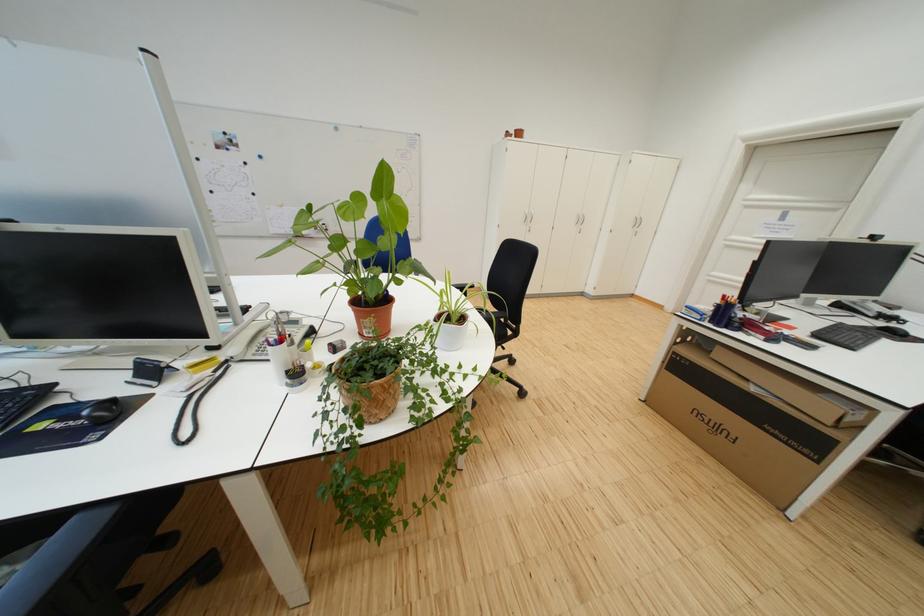
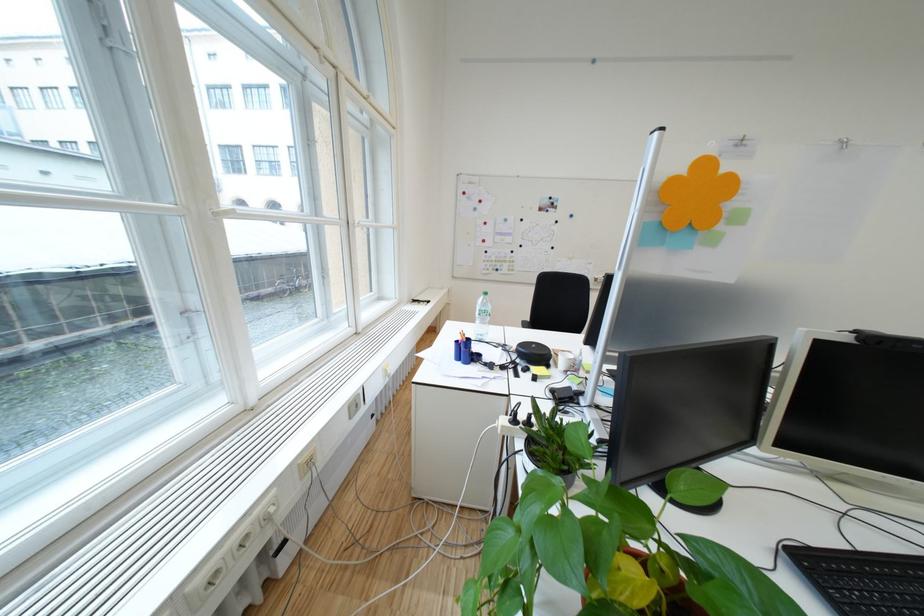
Question: Which direction would the cameraman need to move to produce the second image? Reply with the corresponding letter.

Choices:
 (A) Left
 (B) Right
 (C) Forward
 (D) Backward

Answer: (A)